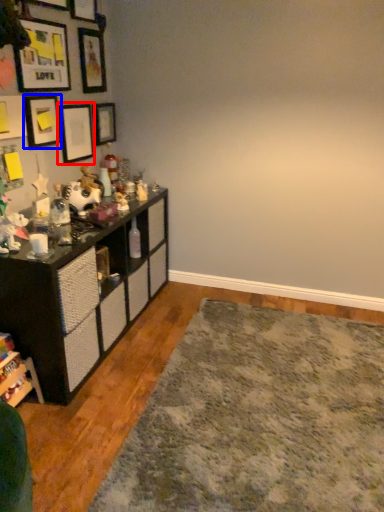
Question: Among these objects, which one is nearest to the camera, picture frame (highlighted by a red box) or picture frame (highlighted by a blue box)?

Choices:
 (A) picture frame
 (B) picture frame

Answer: (B)